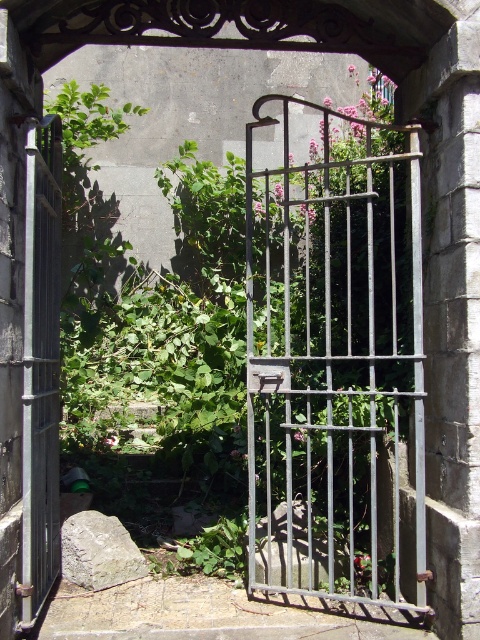
Between metallic gate at center and dark gray metal gate at left, which one appears on the left side from the viewer's perspective?

dark gray metal gate at left

You are a GUI agent. You are given a task and a screenshot of the screen. Output one action in this format:
    pyautogui.click(x=<x>, y=<y>)
    Task: Click on the metallic gate at center
    This screenshot has width=480, height=640.
    Given the screenshot: What is the action you would take?
    pyautogui.click(x=334, y=362)

Identify the location of metallic gate at center. This screenshot has height=640, width=480. (334, 362).